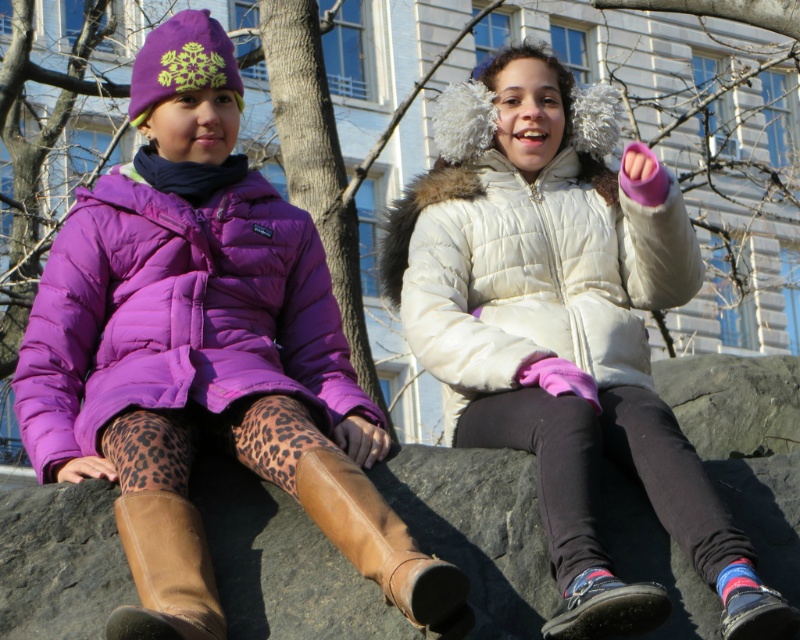
How distant is white fluffy earmuffs at upper center from brown leather boot at lower center?

The distance of white fluffy earmuffs at upper center from brown leather boot at lower center is 5.66 meters.

Which is above, white fluffy earmuffs at upper center or brown leather boot at lower center?

Positioned higher is white fluffy earmuffs at upper center.

Locate an element on the screen. This screenshot has height=640, width=800. white fluffy earmuffs at upper center is located at coordinates (564, 326).

Can you confirm if white fluffy earmuffs at upper center is positioned above white quilted jacket at center?

No, white fluffy earmuffs at upper center is not above white quilted jacket at center.

Is point (562, 115) in front of point (488, 164)?

Yes, point (562, 115) is in front of point (488, 164).

Locate an element on the screen. This screenshot has height=640, width=800. white fluffy earmuffs at upper center is located at coordinates (564, 326).

Which is behind, point (168, 310) or point (449, 204)?

Positioned behind is point (449, 204).

Between point (348, 385) and point (448, 328), which one is positioned behind?

Point (448, 328)

I want to click on purple down jacket at left, so click(x=178, y=314).